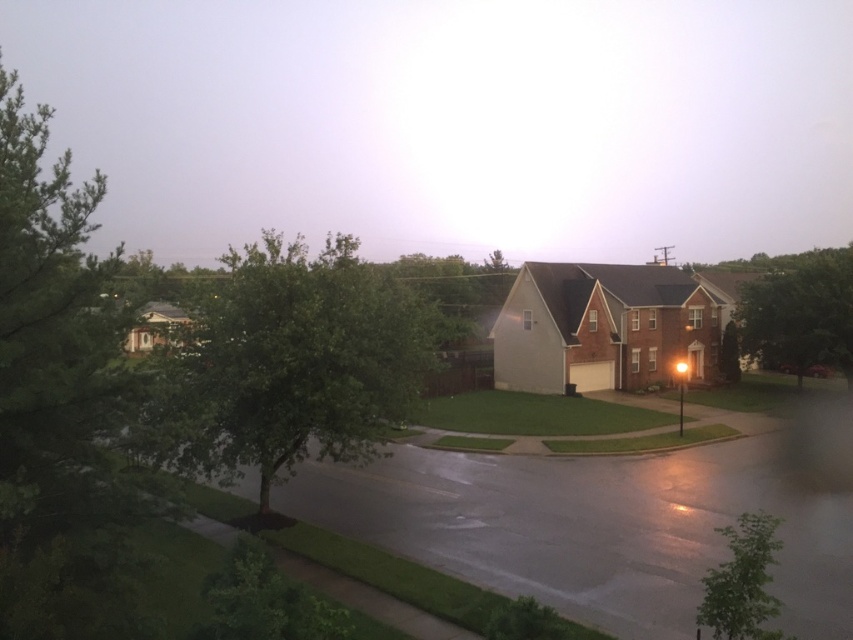
Question: Which point is farther to the camera?

Choices:
 (A) (720, 609)
 (B) (785, 364)

Answer: (B)

Question: Can you confirm if green leafy tree at upper right is positioned below green leafy tree at lower right?

Choices:
 (A) yes
 (B) no

Answer: (B)

Question: Does green leafy tree at center have a greater width compared to green leafy tree at lower right?

Choices:
 (A) no
 (B) yes

Answer: (B)

Question: Which is farther from the green leafy tree at lower right?

Choices:
 (A) green leafy tree at upper right
 (B) green leafy tree at center

Answer: (A)

Question: Which of these objects is positioned farthest from the green leafy tree at upper right?

Choices:
 (A) green leafy tree at center
 (B) green leafy tree at lower right

Answer: (A)

Question: Is green leafy tree at upper right above green leafy tree at lower right?

Choices:
 (A) no
 (B) yes

Answer: (B)